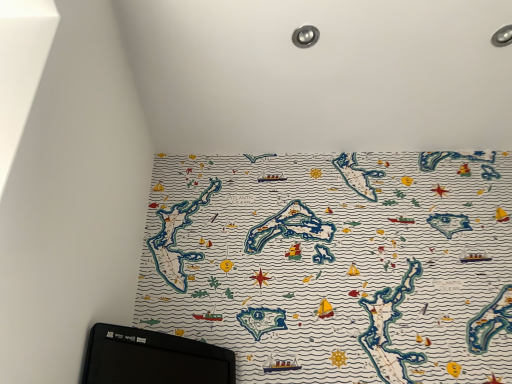
The height and width of the screenshot is (384, 512). I want to click on black glossy monitor at lower left, so click(x=153, y=358).

What do you see at coordinates (153, 358) in the screenshot?
I see `black glossy monitor at lower left` at bounding box center [153, 358].

This screenshot has width=512, height=384. What are the coordinates of `black glossy monitor at lower left` in the screenshot? It's located at (153, 358).